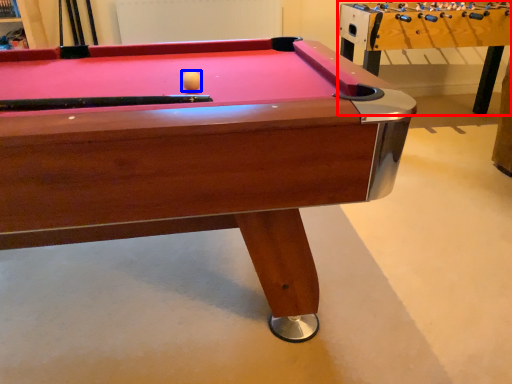
Question: Which object is further to the camera taking this photo, table (highlighted by a red box) or ball (highlighted by a blue box)?

Choices:
 (A) table
 (B) ball

Answer: (A)